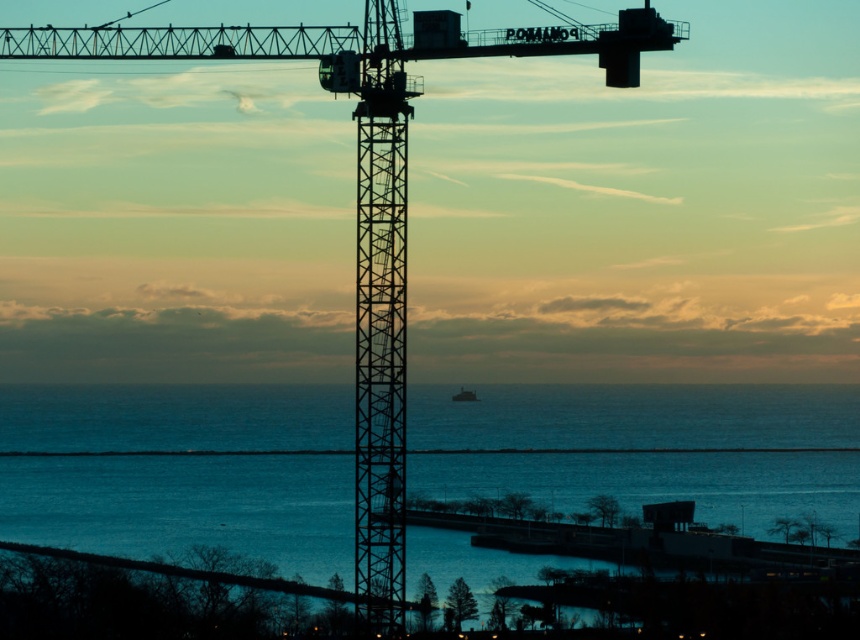
You are a marine biologist who needs to reach the blue water at center from the green matte boat at center for a research mission. Given that your boat can only travel 30 meters before needing to refuel, will you be able to reach the water without refueling?

The distance between the blue water at center and the green matte boat at center is 45.92 meters. Since your boat can only travel 30 meters before needing to refuel, you will need to refuel before reaching the blue water at center.

You are a photographer positioned at the shoreline in the coastal scene. You want to capture a shot where both the blue water at center and the green matte boat at center are visible. Which object should you position closer to the left side of your camera frame?

The blue water at center should be positioned closer to the left side of your camera frame since it is located to the left of the green matte boat at center in the scene.

You are standing at the base of the crane and want to determine which of the two points, point (183, 509) or point (475, 394), is closer to you. Based on the scene, which point is nearer?

Point (183, 509) is closer to you because it is further to the viewer than point (475, 394).